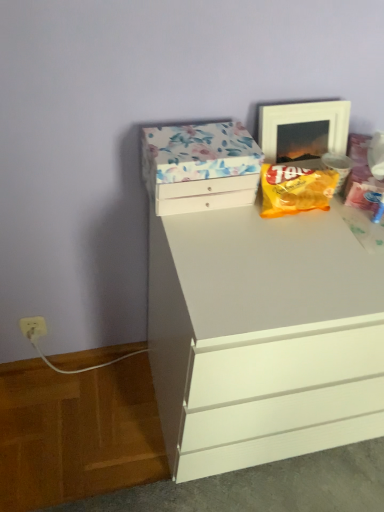
You are a GUI agent. You are given a task and a screenshot of the screen. Output one action in this format:
    pyautogui.click(x=<x>, y=<y>)
    Task: Click on the vacant area that is in front of yellow matte snack packet at upper right
    The height and width of the screenshot is (512, 384).
    Given the screenshot: What is the action you would take?
    pyautogui.click(x=303, y=253)